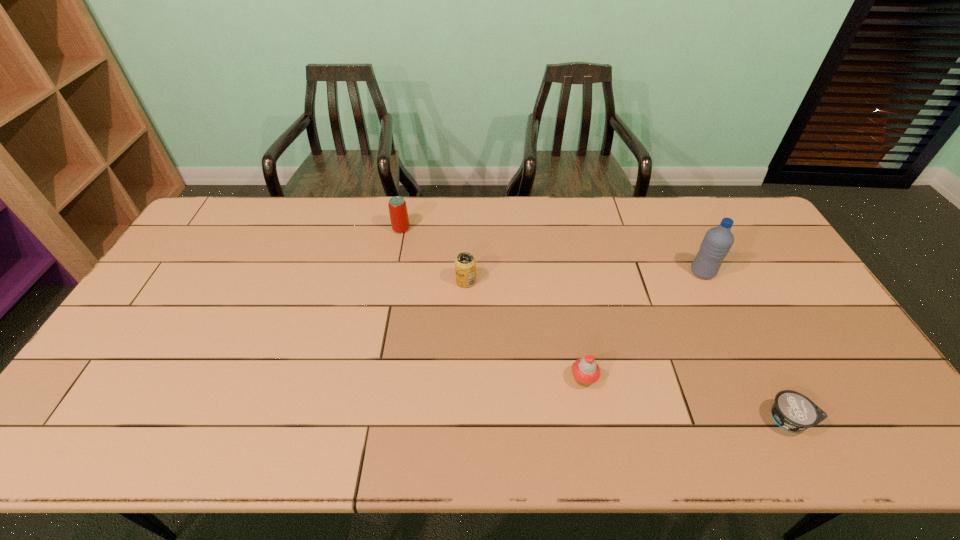
Locate an element on the screen. Image resolution: width=960 pixels, height=540 pixels. free space between the second nearest object and the right beer can is located at coordinates (525, 330).

Locate an element on the screen. object that ranks as the second closest to the fourth farthest object is located at coordinates (793, 411).

Where is `object that is the second nearest to the tallest object`? object that is the second nearest to the tallest object is located at coordinates (586, 371).

What are the coordinates of `free space that satisfies the following two spatial constraints: 1. on the front side of the nearer beer can; 2. on the left side of the left beer can` in the screenshot? It's located at (391, 281).

I want to click on free location that satisfies the following two spatial constraints: 1. on the front side of the farthest object; 2. on the left side of the water bottle, so click(x=393, y=272).

Locate an element on the screen. The height and width of the screenshot is (540, 960). vacant point that satisfies the following two spatial constraints: 1. on the front side of the leftmost object; 2. on the left side of the nearer beer can is located at coordinates (391, 281).